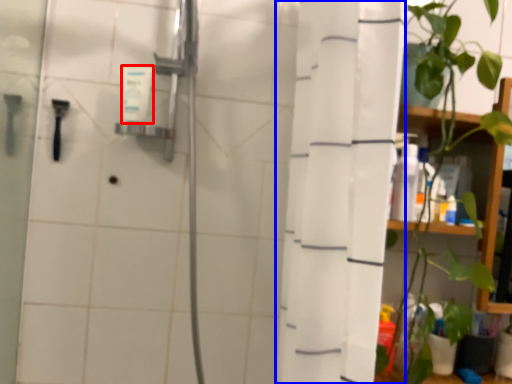
Question: Which object is closer to the camera taking this photo, toiletry (highlighted by a red box) or shower curtain (highlighted by a blue box)?

Choices:
 (A) toiletry
 (B) shower curtain

Answer: (B)